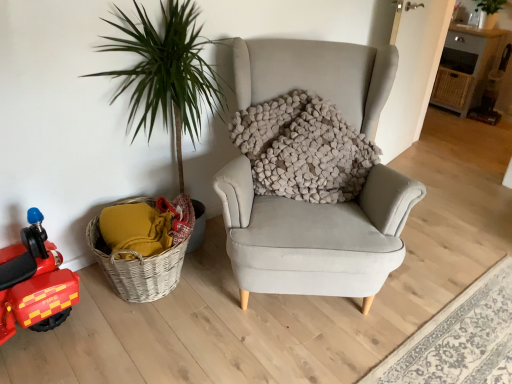
Where is `shiny red plastic toy car at left`? This screenshot has height=384, width=512. shiny red plastic toy car at left is located at coordinates (34, 282).

Does light gray fabric rug at lower right have a greater width compared to woven wood table at upper right?

Correct, the width of light gray fabric rug at lower right exceeds that of woven wood table at upper right.

Is light gray fabric rug at lower right inside or outside of woven wood table at upper right?

light gray fabric rug at lower right lies outside woven wood table at upper right.

From the picture: Between light gray fabric rug at lower right and woven wood table at upper right, which one appears on the left side from the viewer's perspective?

light gray fabric rug at lower right is more to the left.

Identify the location of plain that appears below the woven wood table at upper right (from a real-world perspective). (459, 339).

Considering the positions of objects shiny red plastic toy car at left and woven wood table at upper right in the image provided, who is more to the left, shiny red plastic toy car at left or woven wood table at upper right?

Positioned to the left is shiny red plastic toy car at left.

Considering the sizes of objects shiny red plastic toy car at left and woven wood table at upper right in the image provided, who is bigger, shiny red plastic toy car at left or woven wood table at upper right?

Bigger between the two is woven wood table at upper right.

Is shiny red plastic toy car at left not inside woven wood table at upper right?

Absolutely, shiny red plastic toy car at left is external to woven wood table at upper right.

Is there a large distance between shiny red plastic toy car at left and woven wood table at upper right?

shiny red plastic toy car at left is positioned a significant distance from woven wood table at upper right.

Which of these two, woven wood table at upper right or light gray fabric rug at lower right, stands taller?

With more height is woven wood table at upper right.

From the image's perspective, would you say woven wood table at upper right is shown under light gray fabric rug at lower right?

Incorrect, from the image's perspective, woven wood table at upper right is higher than light gray fabric rug at lower right.

Which of these two, woven wood table at upper right or light gray fabric rug at lower right, is smaller?

With smaller size is light gray fabric rug at lower right.

Considering the relative sizes of woven wood table at upper right and shiny red plastic toy car at left in the image provided, is woven wood table at upper right smaller than shiny red plastic toy car at left?

No, woven wood table at upper right is not smaller than shiny red plastic toy car at left.

Is woven wood table at upper right facing away from shiny red plastic toy car at left?

woven wood table at upper right does not have its back to shiny red plastic toy car at left.

From the image's perspective, who appears lower, woven wood table at upper right or shiny red plastic toy car at left?

shiny red plastic toy car at left appears lower in the image.

Is woven wood table at upper right wider than shiny red plastic toy car at left?

Correct, the width of woven wood table at upper right exceeds that of shiny red plastic toy car at left.

Is light gray fabric rug at lower right in contact with shiny red plastic toy car at left?

No, light gray fabric rug at lower right is not with shiny red plastic toy car at left.

Is light gray fabric rug at lower right positioned behind shiny red plastic toy car at left?

Yes, light gray fabric rug at lower right is further from the camera.

Does point (441, 357) come behind point (19, 264)?

Yes.

The height and width of the screenshot is (384, 512). I want to click on plain behind the shiny red plastic toy car at left, so click(x=459, y=339).

Considering the relative sizes of shiny red plastic toy car at left and light gray fabric rug at lower right in the image provided, is shiny red plastic toy car at left wider than light gray fabric rug at lower right?

No, shiny red plastic toy car at left is not wider than light gray fabric rug at lower right.

Between point (6, 264) and point (505, 302), which one is positioned behind?

The point (505, 302) is behind.

From a real-world perspective, between shiny red plastic toy car at left and light gray fabric rug at lower right, who is vertically higher?

shiny red plastic toy car at left is physically above.

This screenshot has height=384, width=512. In order to click on plain that appears below the shiny red plastic toy car at left (from a real-world perspective) in this screenshot , I will do `click(459, 339)`.

Identify the location of plain below the woven wood table at upper right (from a real-world perspective). [459, 339].

What are the coordinates of `table that is behind the shiny red plastic toy car at left` in the screenshot? It's located at pyautogui.click(x=466, y=67).

Considering their positions, is woven wood table at upper right positioned further to shiny red plastic toy car at left than light gray fabric rug at lower right?

Among the two, woven wood table at upper right is located further to shiny red plastic toy car at left.

From the image, which object appears to be nearer to light gray fabric rug at lower right, shiny red plastic toy car at left or woven wood table at upper right?

shiny red plastic toy car at left is closer to light gray fabric rug at lower right.

Based on their spatial positions, is light gray fabric rug at lower right or shiny red plastic toy car at left closer to woven wood table at upper right?

The object closer to woven wood table at upper right is light gray fabric rug at lower right.

Based on their spatial positions, is woven wood table at upper right or shiny red plastic toy car at left further from light gray fabric rug at lower right?

woven wood table at upper right lies further to light gray fabric rug at lower right than the other object.

Estimate the real-world distances between objects in this image. Which object is closer to shiny red plastic toy car at left, light gray fabric rug at lower right or woven wood table at upper right?

Based on the image, light gray fabric rug at lower right appears to be nearer to shiny red plastic toy car at left.

Which object lies nearer to the anchor point woven wood table at upper right, shiny red plastic toy car at left or light gray fabric rug at lower right?

Among the two, light gray fabric rug at lower right is located nearer to woven wood table at upper right.

This screenshot has width=512, height=384. I want to click on plain between shiny red plastic toy car at left and woven wood table at upper right, so click(459, 339).